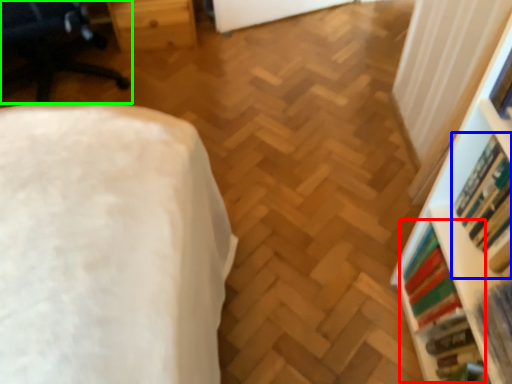
Question: Considering the real-world distances, which object is farthest from book (highlighted by a red box)? book (highlighted by a blue box) or furniture (highlighted by a green box)?

Choices:
 (A) book
 (B) furniture

Answer: (B)